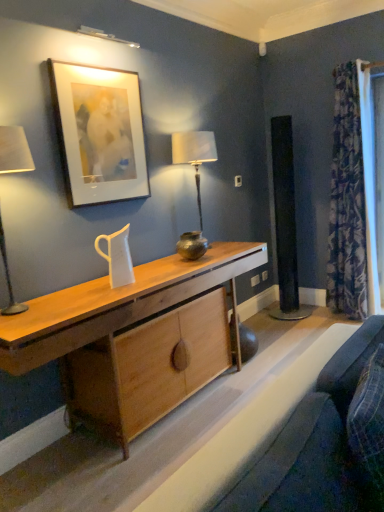
The height and width of the screenshot is (512, 384). Find the location of `blank space situated above matte white picture frame at upper left (from a real-world perspective)`. blank space situated above matte white picture frame at upper left (from a real-world perspective) is located at coordinates (93, 59).